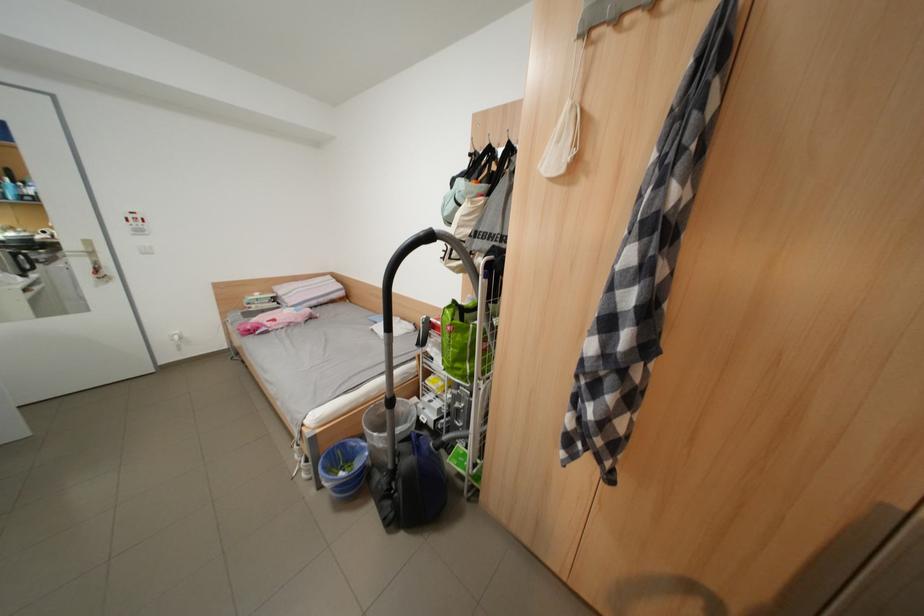
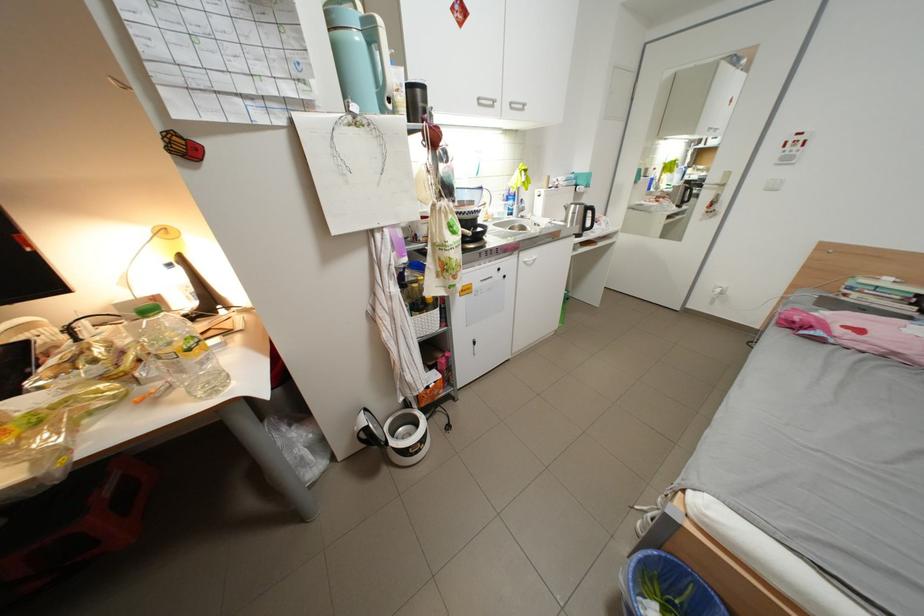
The point at (264, 307) is marked in the first image. Where is the corresponding point in the second image?

(867, 296)